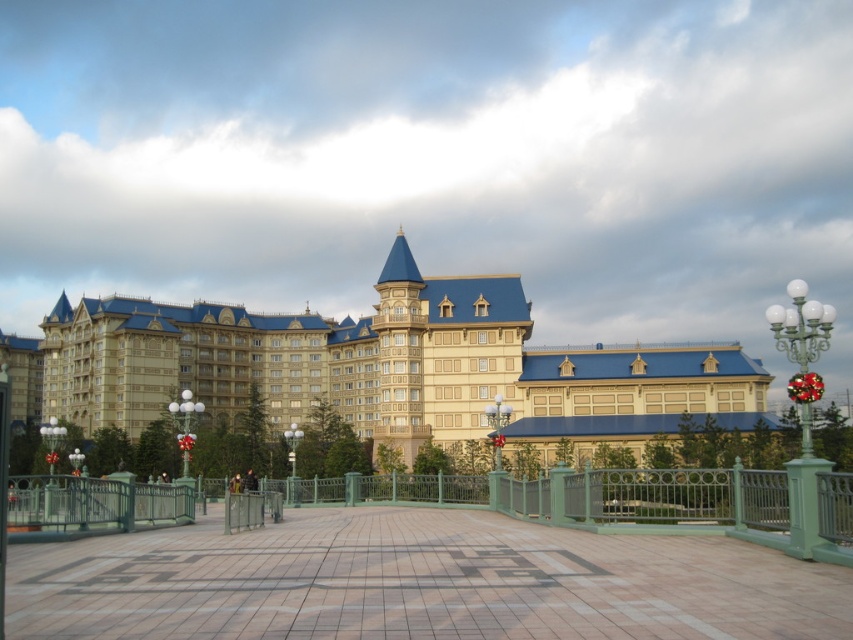
Does pebble stone walkway at center have a greater width compared to matte gold palace at center?

In fact, pebble stone walkway at center might be narrower than matte gold palace at center.

Measure the distance from pebble stone walkway at center to matte gold palace at center.

pebble stone walkway at center is 53.62 meters away from matte gold palace at center.

Is point (782, 632) less distant than point (132, 324)?

Yes, it is in front of point (132, 324).

The width and height of the screenshot is (853, 640). Find the location of `pebble stone walkway at center`. pebble stone walkway at center is located at coordinates click(416, 582).

Does pebble stone walkway at center come in front of green metal fence at center?

Yes, it is.

Does point (120, 589) come farther from viewer compared to point (839, 493)?

That is False.

Between point (161, 616) and point (846, 531), which one is positioned behind?

Point (846, 531)

This screenshot has height=640, width=853. Find the location of `pebble stone walkway at center`. pebble stone walkway at center is located at coordinates (416, 582).

Can you confirm if matte gold palace at center is positioned to the left of green metal fence at center?

Yes, matte gold palace at center is to the left of green metal fence at center.

At what (x,y) coordinates should I click in order to perform the action: click on matte gold palace at center. Please return your answer as a coordinate pair (x, y). The height and width of the screenshot is (640, 853). Looking at the image, I should click on (390, 368).

Between point (109, 349) and point (315, 480), which one is positioned in front?

Point (315, 480) is in front.

Locate an element on the screen. matte gold palace at center is located at coordinates [x=390, y=368].